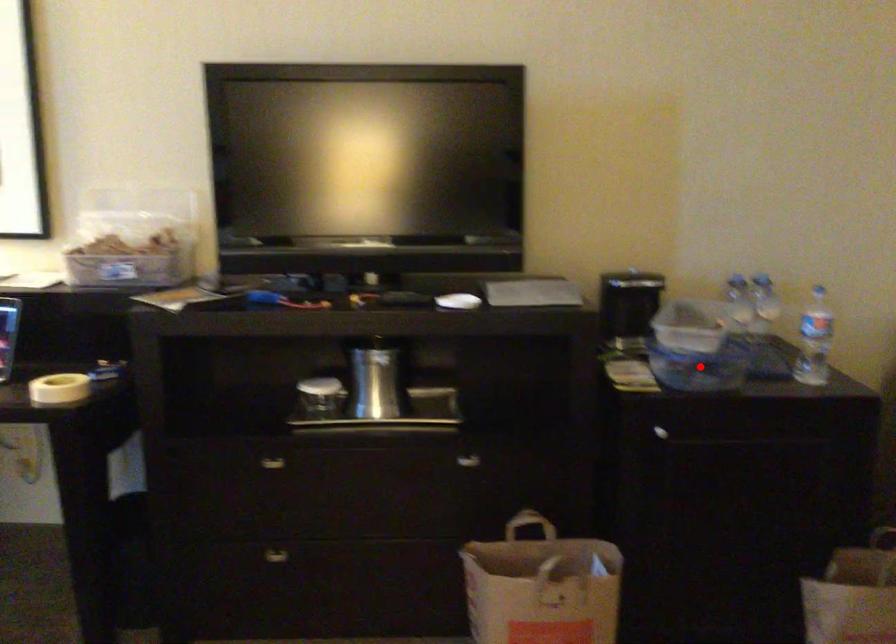
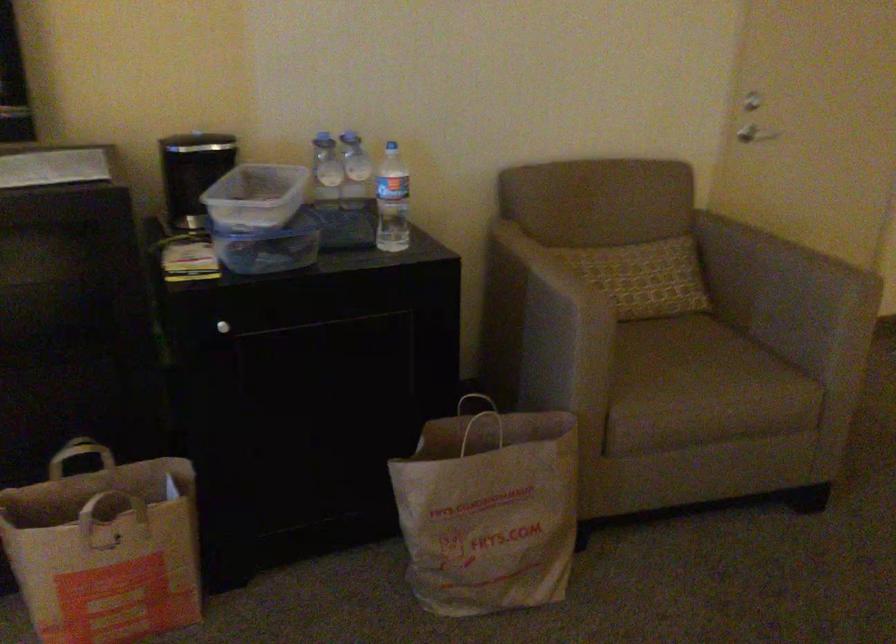
Find the pixel in the second image that matches the highlighted location in the first image.

(269, 245)